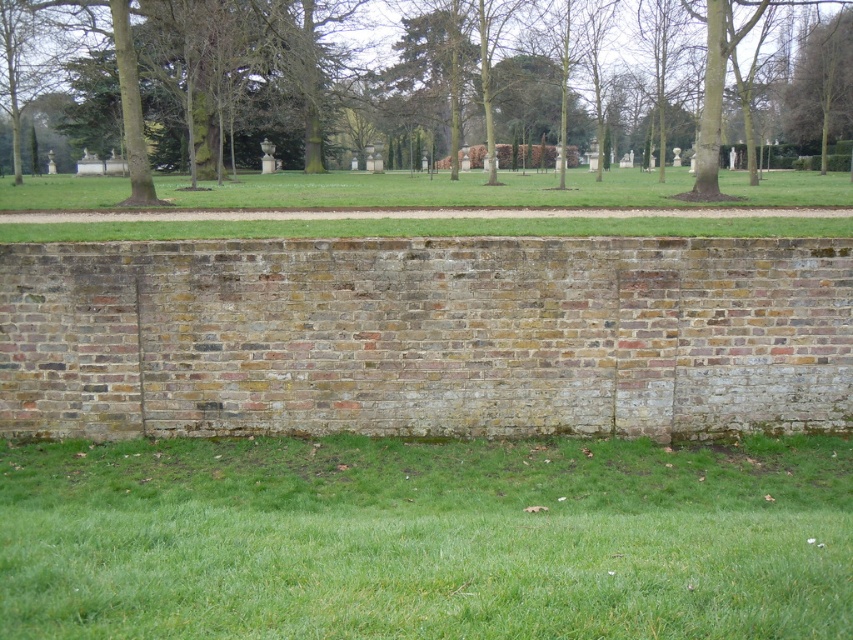
Question: Does green grass at lower center appear on the right side of green leafy tree at center?

Choices:
 (A) no
 (B) yes

Answer: (B)

Question: Which point is farther to the camera?

Choices:
 (A) green leafy tree at center
 (B) green leafy tree at upper right

Answer: (B)

Question: Considering the real-world distances, which object is farthest from the green leafy tree at upper right?

Choices:
 (A) green leafy tree at center
 (B) green grass at lower center

Answer: (B)

Question: Which object is positioned farthest from the green grass at lower center?

Choices:
 (A) green leafy tree at center
 (B) green leafy tree at upper right

Answer: (B)

Question: Can you confirm if green grass at lower center is positioned above green leafy tree at upper right?

Choices:
 (A) no
 (B) yes

Answer: (A)

Question: From the image, what is the correct spatial relationship of green grass at lower center in relation to green leafy tree at upper right?

Choices:
 (A) below
 (B) above

Answer: (A)